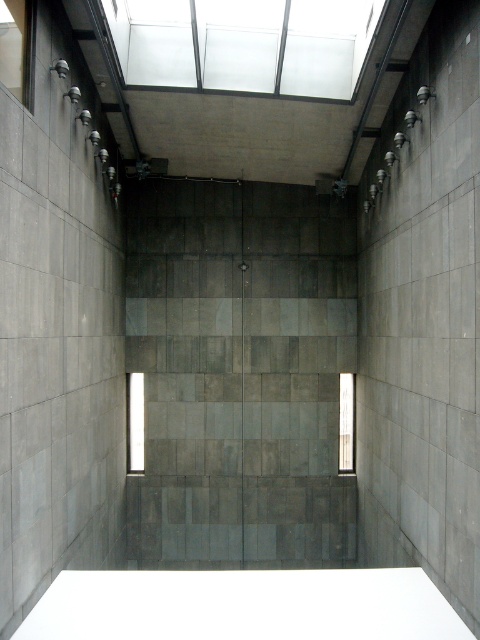
Question: Can you confirm if transparent glass skylight at upper center is wider than transparent glass window at center?

Choices:
 (A) yes
 (B) no

Answer: (A)

Question: Which point is closer to the camera?

Choices:
 (A) (136, 380)
 (B) (20, 36)
 (C) (352, 436)
 (D) (134, 26)

Answer: (B)

Question: Is transparent glass window at upper left positioned behind clear glass window at center?

Choices:
 (A) yes
 (B) no

Answer: (B)

Question: Is transparent glass skylight at upper center closer to camera compared to clear glass window at center?

Choices:
 (A) no
 (B) yes

Answer: (B)

Question: Based on their relative distances, which object is nearer to the transparent glass skylight at upper center?

Choices:
 (A) clear glass window at center
 (B) transparent glass window at upper left
 (C) transparent glass window at center

Answer: (B)

Question: Which point is farther from the camera taking this photo?

Choices:
 (A) (139, 388)
 (B) (21, 13)
 (C) (349, 388)

Answer: (C)